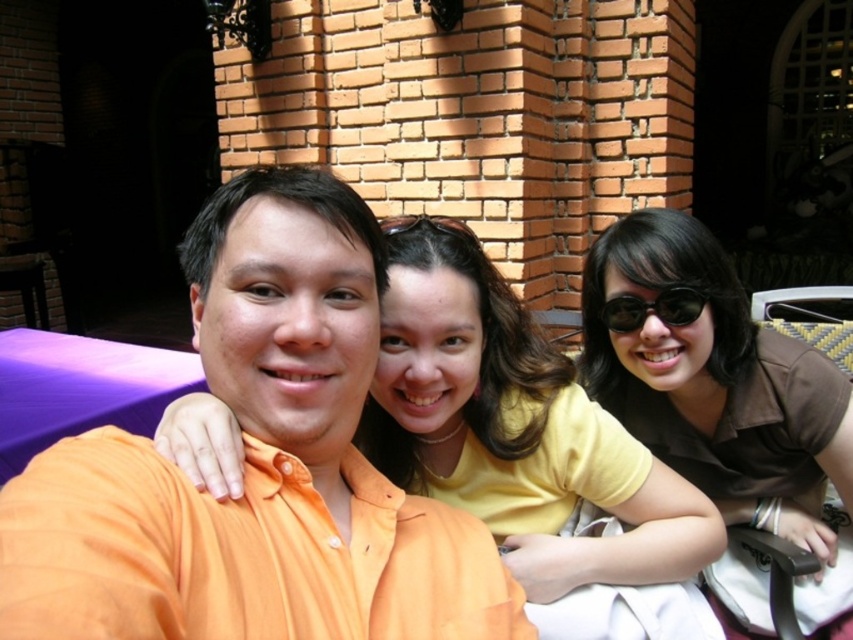
You are trying to decide which of the two shirts in the image is smaller. You see the yellow matte shirt at center and the brown matte shirt at center. Based on the scene, which one is smaller?

The yellow matte shirt at center is smaller than the brown matte shirt at center according to the description.

You are holding a camera and want to take a selfie with the orange cotton shirt at center. If you are standing 16.37 inches away from the shirt, will you be able to capture the entire scene in your photo?

The distance between you and the orange cotton shirt at center is 16.37 inches. Whether you can capture the entire scene depends on your camera lens and field of view, but the shirt is within the typical selfie range.